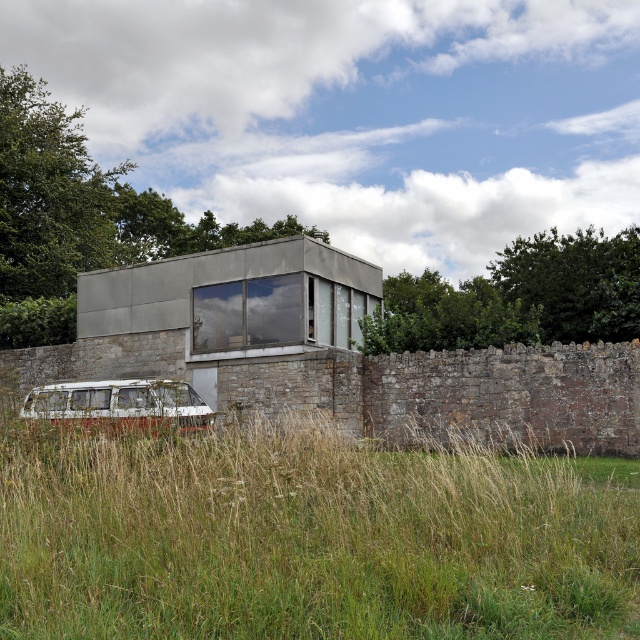
Question: Among these objects, which one is farthest from the camera?

Choices:
 (A) green grass at lower left
 (B) white matte van at lower left

Answer: (B)

Question: Does green grass at lower left come in front of white matte van at lower left?

Choices:
 (A) no
 (B) yes

Answer: (B)

Question: Does green grass at lower left have a lesser width compared to white matte van at lower left?

Choices:
 (A) no
 (B) yes

Answer: (B)

Question: Does green grass at lower left have a greater width compared to white matte van at lower left?

Choices:
 (A) yes
 (B) no

Answer: (B)

Question: Which of the following is the closest to the observer?

Choices:
 (A) (x=19, y=449)
 (B) (x=172, y=384)

Answer: (A)